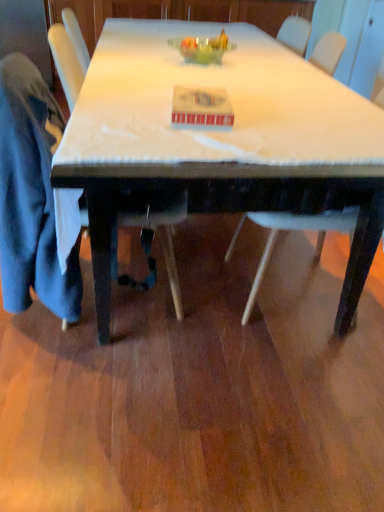
Where is `vacant area that lies between velvet blue jacket at left, arranged as the first chair when viewed from the left, and white plastic chair at lower right, arranged as the 2th chair when viewed from the left`? The width and height of the screenshot is (384, 512). vacant area that lies between velvet blue jacket at left, arranged as the first chair when viewed from the left, and white plastic chair at lower right, arranged as the 2th chair when viewed from the left is located at coordinates (201, 300).